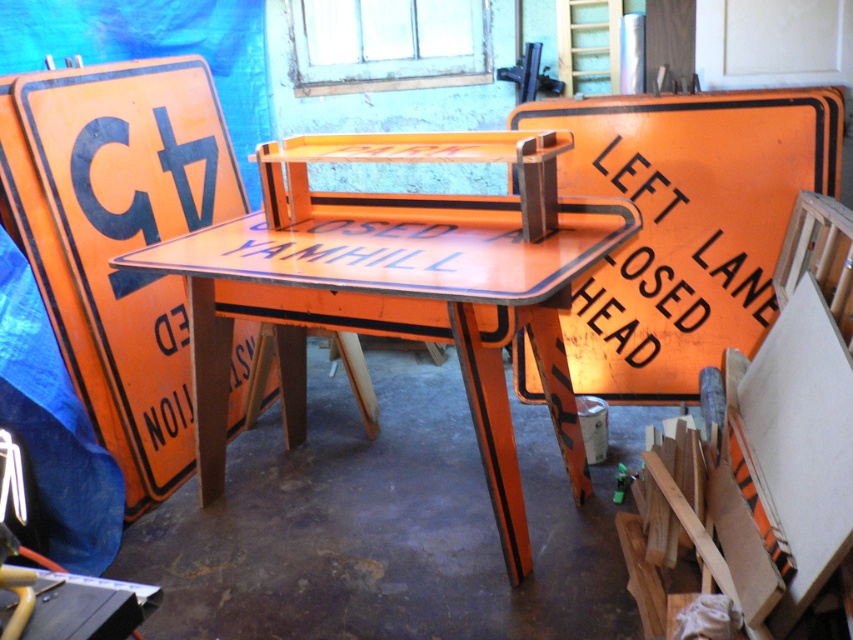
Question: Does orange painted metal sign at center appear over green plastic hammer at lower right?

Choices:
 (A) yes
 (B) no

Answer: (A)

Question: Is orange painted wood table at center wider than orange painted signboard at right?

Choices:
 (A) no
 (B) yes

Answer: (B)

Question: Which point is farther to the camera?

Choices:
 (A) orange painted wood sign at left
 (B) orange painted wood table at center
 (C) green plastic hammer at lower right

Answer: (C)

Question: Where is orange painted wood table at center located in relation to green plastic hammer at lower right in the image?

Choices:
 (A) right
 (B) left

Answer: (B)

Question: Which object is positioned farthest from the orange painted signboard at right?

Choices:
 (A) orange painted metal sign at center
 (B) green plastic hammer at lower right
 (C) orange painted wood sign at left

Answer: (C)

Question: Among these objects, which one is nearest to the camera?

Choices:
 (A) orange painted signboard at right
 (B) green plastic hammer at lower right

Answer: (B)